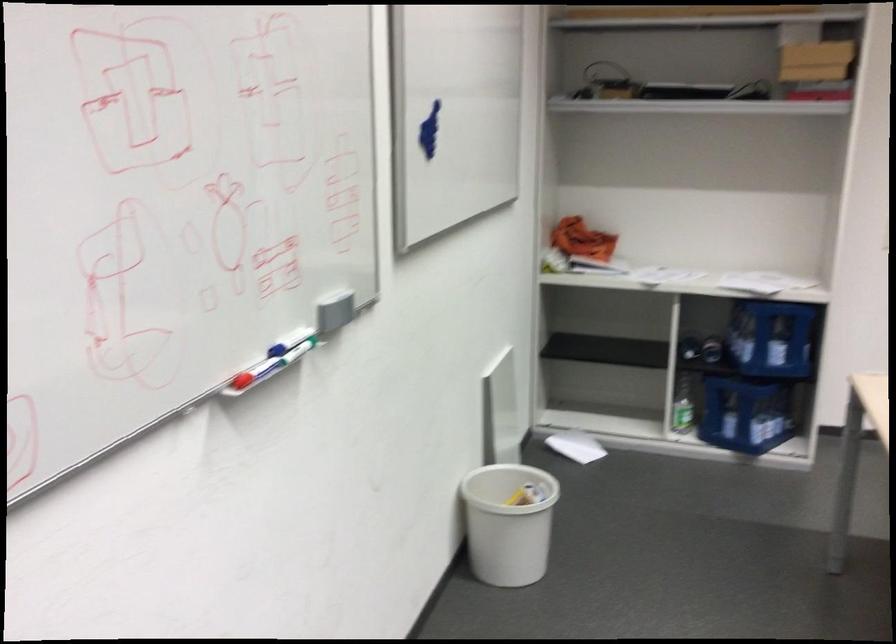
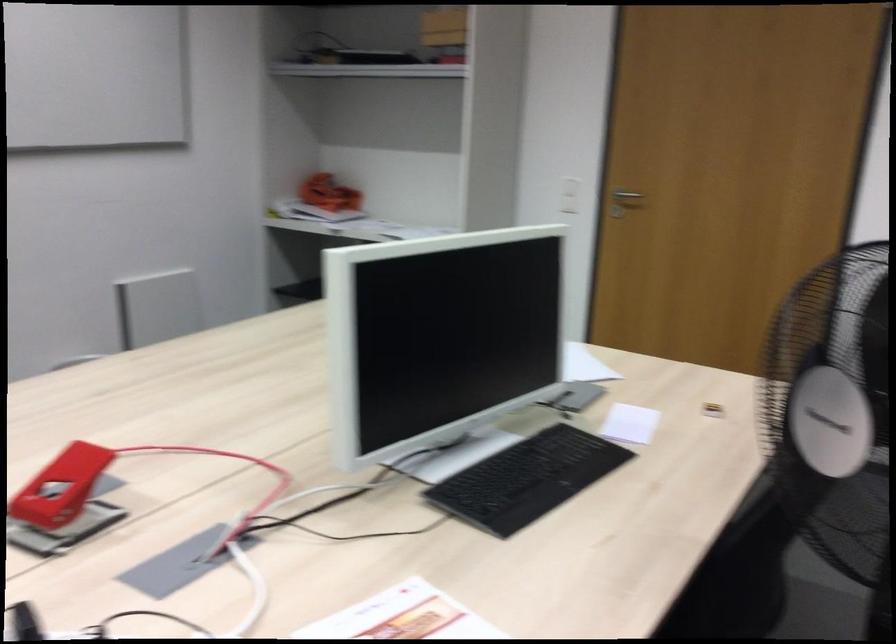
Question: I am providing you with two images of the same scene from different viewpoints. After the viewpoint changes to image2, which objects are now occluded?

Choices:
 (A) white bucket
 (B) silver door handle
 (C) dark laundry hamper
 (D) small yellow box

Answer: (A)